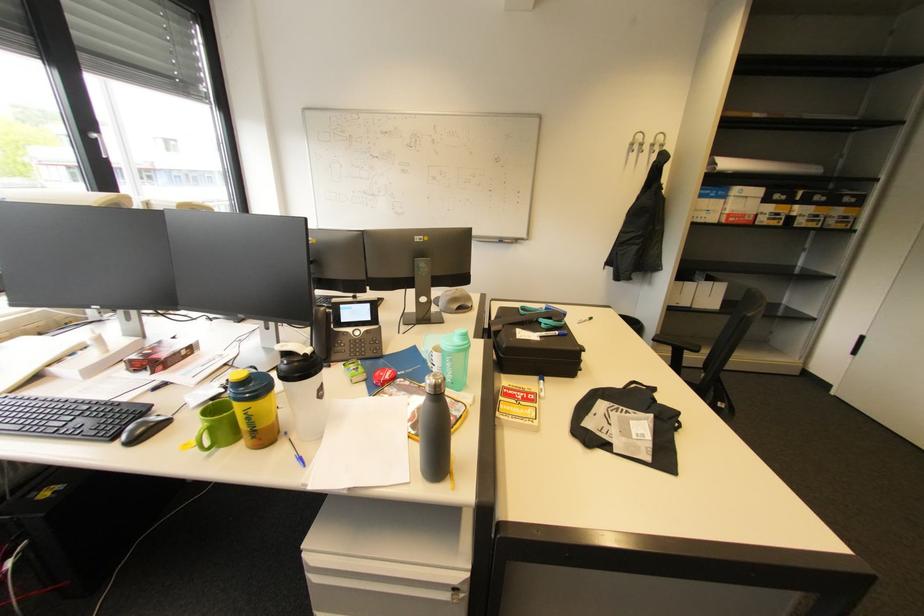
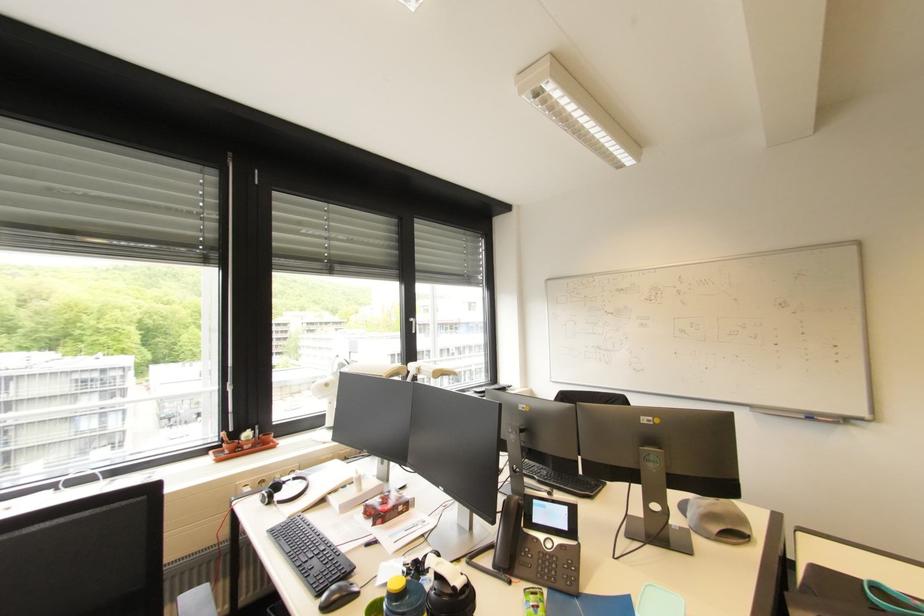
Find the pixel in the second image that matches (x=373, y=305) in the first image.

(572, 509)